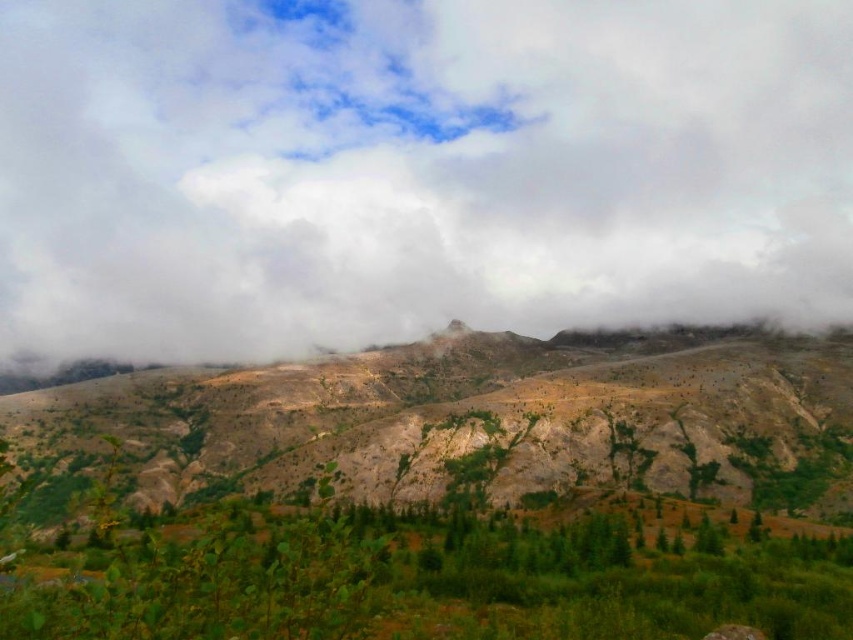
You are an airplane pilot flying over a mountain range. You notice a white fluffy cloud at upper center and a rugged stone mountain at center. Which one appears larger from your current altitude?

The white fluffy cloud at upper center appears larger than the rugged stone mountain at center from your current altitude.